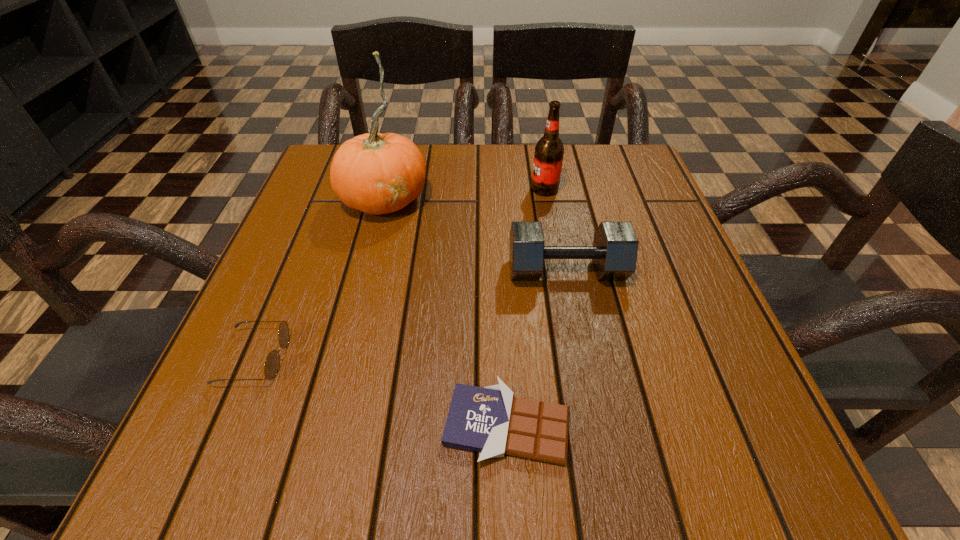
Find the location of a particular element. empty space between the third farthest object and the tallest object is located at coordinates (475, 234).

You are a GUI agent. You are given a task and a screenshot of the screen. Output one action in this format:
    pyautogui.click(x=<x>, y=<y>)
    Task: Click on the vacant area between the third tallest object and the root beer
    
    Given the screenshot: What is the action you would take?
    pyautogui.click(x=556, y=230)

At what (x,y) coordinates should I click in order to perform the action: click on object that can be found as the third closest to the root beer. Please return your answer as a coordinate pair (x, y). Looking at the image, I should click on (490, 420).

What are the coordinates of `object identified as the fourth closest to the dumbbell` in the screenshot? It's located at (272, 363).

You are a GUI agent. You are given a task and a screenshot of the screen. Output one action in this format:
    pyautogui.click(x=<x>, y=<y>)
    Task: Click on the free point that satisfies the following two spatial constraints: 1. on the back side of the dumbbell; 2. on the left side of the chocolate bar
    
    Given the screenshot: What is the action you would take?
    pyautogui.click(x=500, y=271)

Locate an element on the screen. The image size is (960, 540). free space that satisfies the following two spatial constraints: 1. on the front side of the pumpkin; 2. on the left side of the shortest object is located at coordinates (328, 424).

What are the coordinates of `free location that satisfies the following two spatial constraints: 1. on the back side of the root beer; 2. on the right side of the chocolate bar` in the screenshot? It's located at (496, 189).